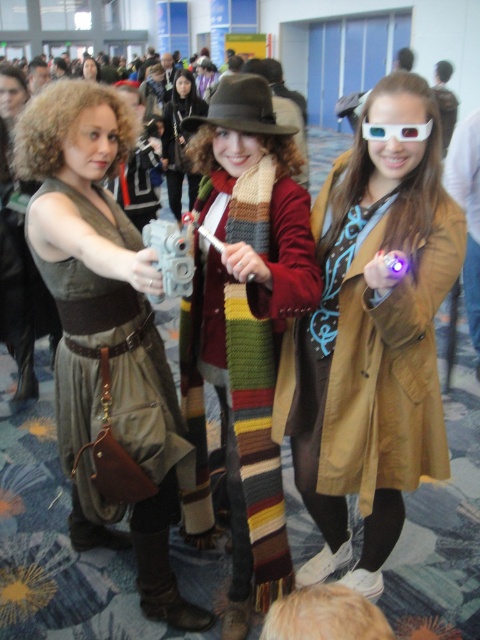
Is brown leather coat at center positioned in front of matte brown dress at center?

Yes, brown leather coat at center is closer to the viewer.

Is brown leather coat at center thinner than matte brown dress at center?

Indeed, brown leather coat at center has a lesser width compared to matte brown dress at center.

Identify the location of brown leather coat at center. This screenshot has height=640, width=480. (374, 337).

Identify the location of brown leather coat at center. Image resolution: width=480 pixels, height=640 pixels. (374, 337).

Is matte brown dress at center to the left of knitted scarf at center from the viewer's perspective?

Indeed, matte brown dress at center is positioned on the left side of knitted scarf at center.

Which is above, matte brown dress at center or knitted scarf at center?

Positioned higher is knitted scarf at center.

Between point (91, 536) and point (300, 202), which one is positioned in front?

Point (300, 202) is more forward.

The width and height of the screenshot is (480, 640). What are the coordinates of `matte brown dress at center` in the screenshot? It's located at (105, 332).

Can you confirm if brown leather coat at center is bigger than matte black dress at center?

Indeed, brown leather coat at center has a larger size compared to matte black dress at center.

Describe the element at coordinates (374, 337) in the screenshot. I see `brown leather coat at center` at that location.

I want to click on brown leather coat at center, so click(x=374, y=337).